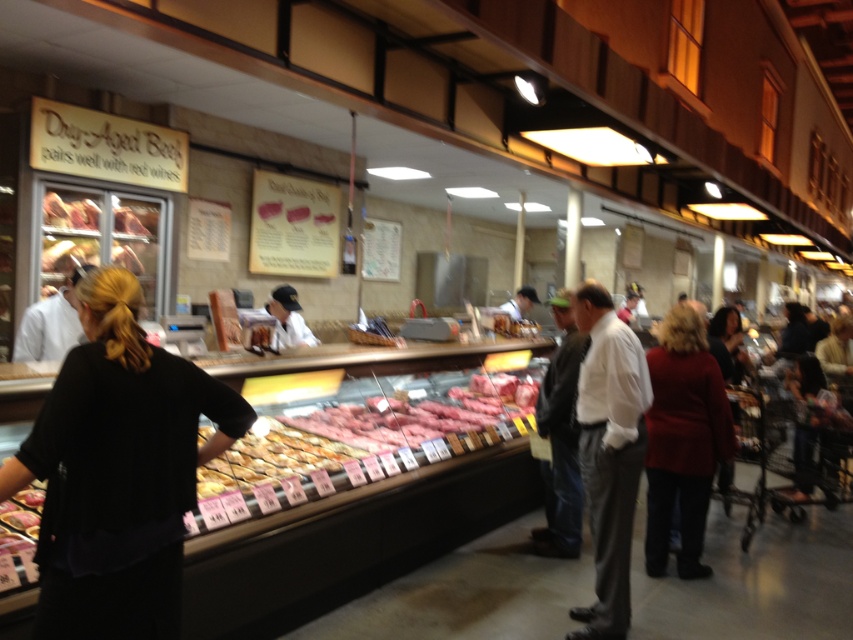
What do you see at coordinates (99, 234) in the screenshot?
I see `smoked ham at center` at bounding box center [99, 234].

Does smoked ham at center come behind golden brown bread at center?

Yes, smoked ham at center is behind golden brown bread at center.

Which is behind, point (154, 212) or point (234, 449)?

The point (154, 212) is behind.

Where is `smoked ham at center`? smoked ham at center is located at coordinates (99, 234).

Does pink glossy meat at lower left have a larger size compared to white shirt at center?

Incorrect, pink glossy meat at lower left is not larger than white shirt at center.

Consider the image. Is pink glossy meat at lower left below white shirt at center?

Yes, pink glossy meat at lower left is below white shirt at center.

Locate an element on the screen. The width and height of the screenshot is (853, 640). pink glossy meat at lower left is located at coordinates (19, 522).

You are a GUI agent. You are given a task and a screenshot of the screen. Output one action in this format:
    pyautogui.click(x=<x>, y=<y>)
    Task: Click on the pink glossy meat at lower left
    The width and height of the screenshot is (853, 640).
    Given the screenshot: What is the action you would take?
    pyautogui.click(x=19, y=522)

Is pink glossy meat at center bigger than white shirt at center?

Yes, pink glossy meat at center is bigger than white shirt at center.

The height and width of the screenshot is (640, 853). What are the coordinates of `pink glossy meat at center` in the screenshot? It's located at (405, 419).